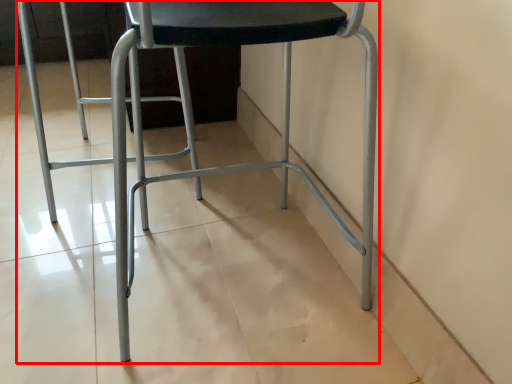
Question: From the image's perspective, what is the correct spatial positioning of chair (annotated by the red box) in reference to swivel chair?

Choices:
 (A) below
 (B) above

Answer: (A)